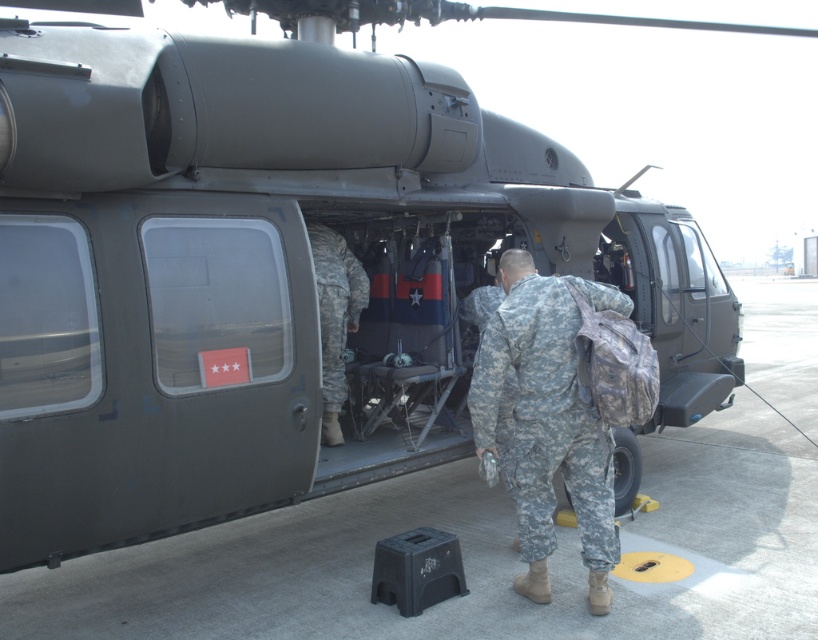
Question: Which object is farther from the camera taking this photo?

Choices:
 (A) camouflage uniform at center
 (B) camouflage fabric soldier at center

Answer: (A)

Question: Which of the following is the closest to the observer?

Choices:
 (A) camouflage uniform at center
 (B) camouflage fabric soldier at center

Answer: (B)

Question: Can you confirm if camouflage fabric soldier at center is positioned below camouflage uniform at center?

Choices:
 (A) yes
 (B) no

Answer: (A)

Question: Does camouflage fabric soldier at center come in front of camouflage uniform at center?

Choices:
 (A) no
 (B) yes

Answer: (B)

Question: Considering the relative positions of camouflage fabric soldier at center and camouflage uniform at center in the image provided, where is camouflage fabric soldier at center located with respect to camouflage uniform at center?

Choices:
 (A) right
 (B) left

Answer: (A)